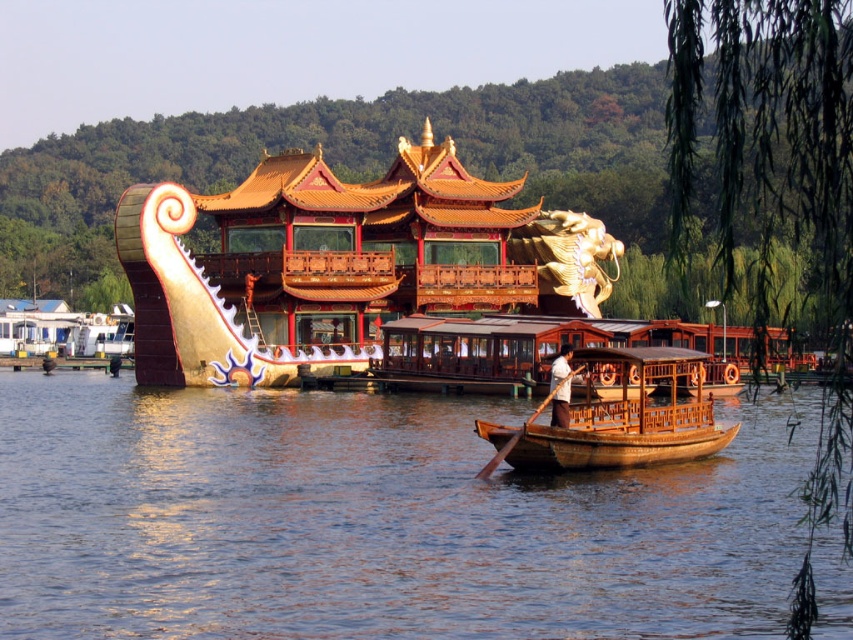
You are standing at the lakeside and see the brown wooden boat at center. If you want to take a photo of the boat with your phone, which has a maximum zoom range of 50 meters, will you be able to capture the boat clearly without moving closer?

The brown wooden boat at center is 55.64 meters away from camera. Since the maximum zoom range is 50 meters, the boat is beyond the phone camera zoom limit. You will need to move closer to take a clear photo.

You are standing at the point marked as point (373,520). Which object is right in front of you?

The brown wooden boat at center is located at point (373,520), so the object right in front of you is the brown wooden boat at center.